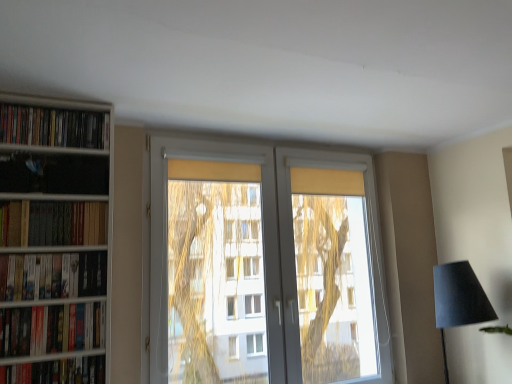
Question: From their relative heights in the image, would you say hardcover books at left, which is counted as the 2th book, starting from the top, is taller or shorter than hardcover book at lower left, which appears as the 5th book when viewed from the top?

Choices:
 (A) short
 (B) tall

Answer: (B)

Question: Choose the correct answer: Is hardcover books at left, which is counted as the 2th book, starting from the top, inside hardcover book at lower left, the first book in the bottom-to-top sequence, or outside it?

Choices:
 (A) outside
 (B) inside

Answer: (A)

Question: Which object is the closest to the hardcover books at left, which appears as the fourth book when ordered from the bottom?

Choices:
 (A) matte black lampshade at lower right
 (B) hardcover books at left, which is the 4th book in top-to-bottom order
 (C) matte black books at left, arranged as the 1th book when viewed from the top
 (D) hardcover book at lower left, the first book in the bottom-to-top sequence
 (E) wooden bookshelf at left

Answer: (E)

Question: Which of these objects is positioned farthest from the hardcover books at left, which is the 4th book in top-to-bottom order?

Choices:
 (A) matte black bookshelf at left, which appears as the third book when viewed from the top
 (B) hardcover book at lower left, which appears as the 5th book when viewed from the top
 (C) white plastic window at center
 (D) matte black books at left, the fifth book positioned from the bottom
 (E) matte black lampshade at lower right

Answer: (E)